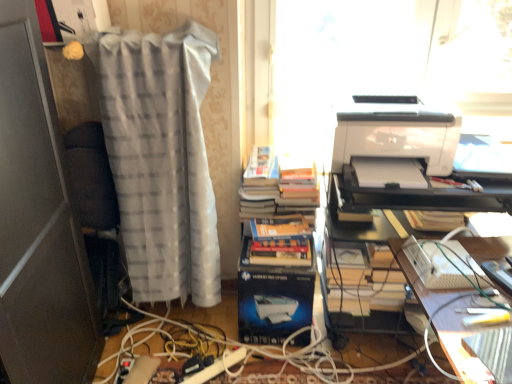
Image resolution: width=512 pixels, height=384 pixels. In order to click on vacant area that lies between white plastic keyboard at lower right, which ranks as the 2th equipment in right-to-left order, and metallic silver remote control at lower right, which appears as the 1th equipment when viewed from the right in this screenshot , I will do `click(477, 287)`.